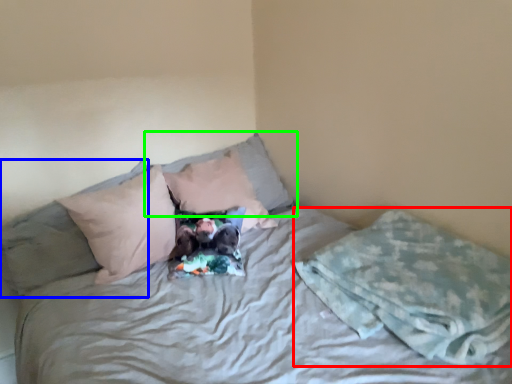
Question: Which object is positioned closest to blanket (highlighted by a red box)? Select from pillow (highlighted by a blue box) and pillow (highlighted by a green box).

Choices:
 (A) pillow
 (B) pillow

Answer: (B)